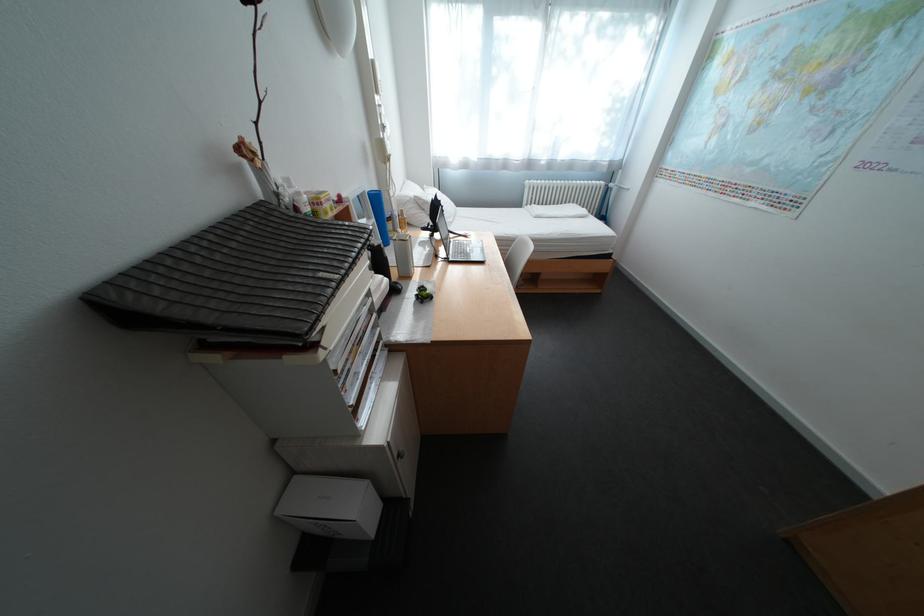
Find where to lift the blue cylindrical container. Please return your answer as a coordinate pair (x, y).

(379, 215)